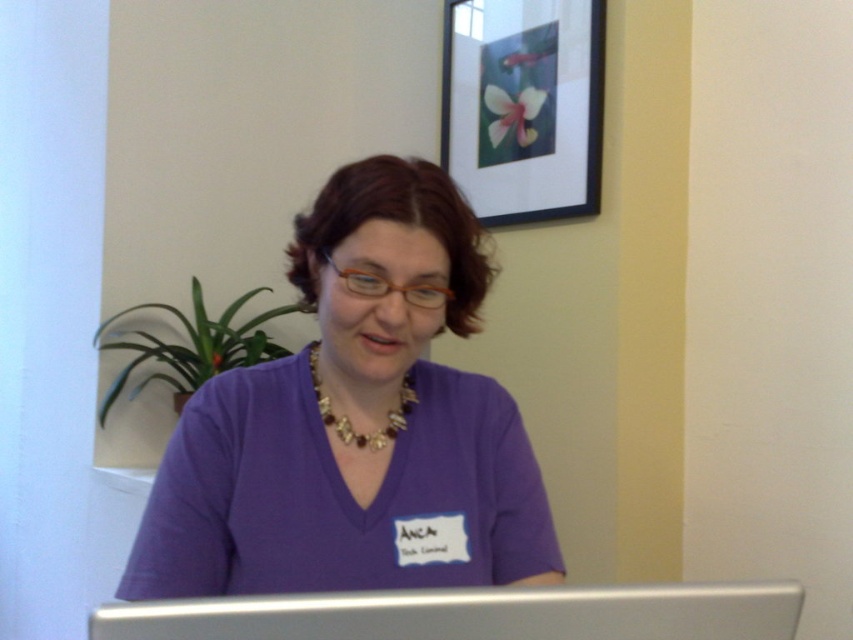
You are standing in front of the desk where Anca is sitting. You notice two points marked on the wall behind her. The first point is at coordinates point (x=410, y=333) and the second point is at point (x=593, y=120). Which of these points is closer to you?

Point (x=410, y=333) is closer to the viewer than point (x=593, y=120).